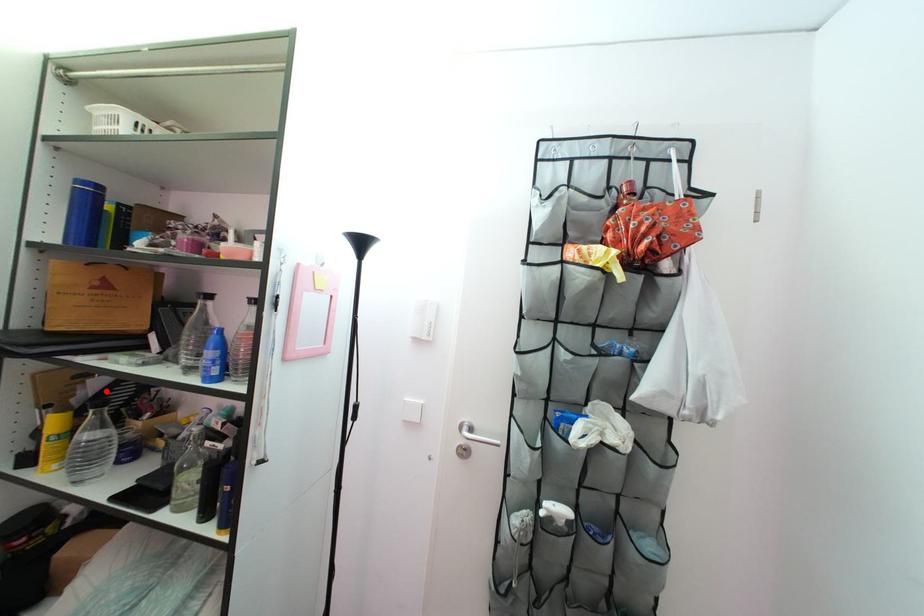
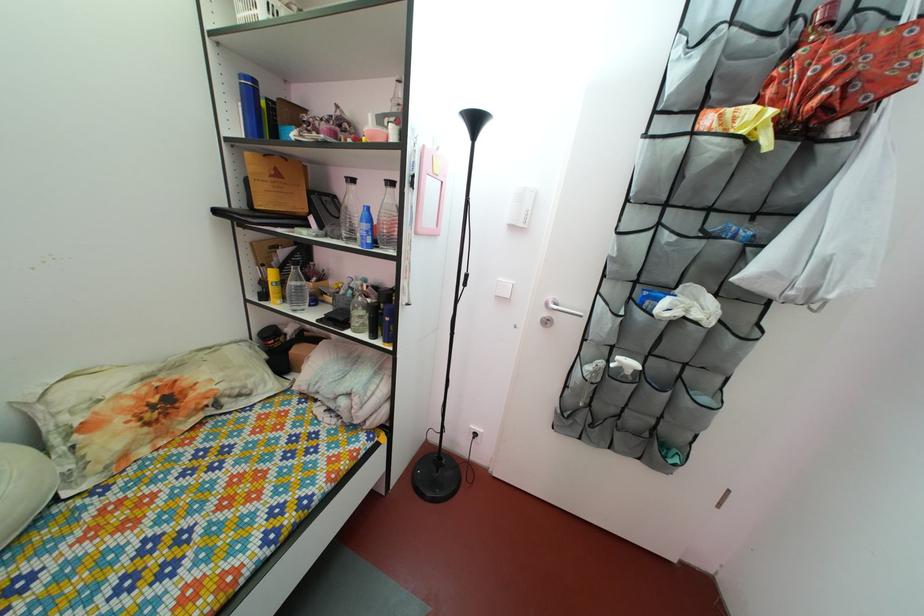
The point at the highlighted location is marked in the first image. Where is the corresponding point in the second image?

(292, 262)